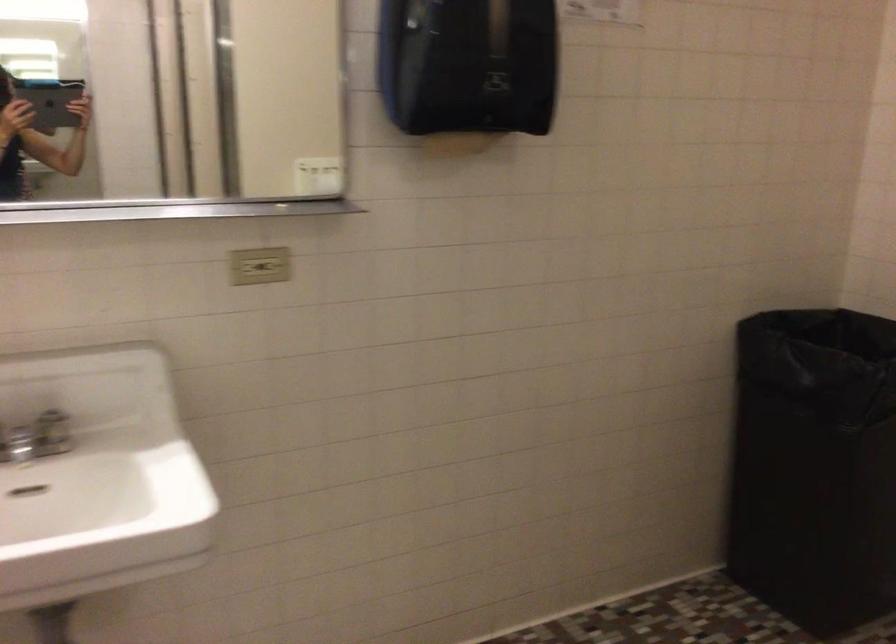
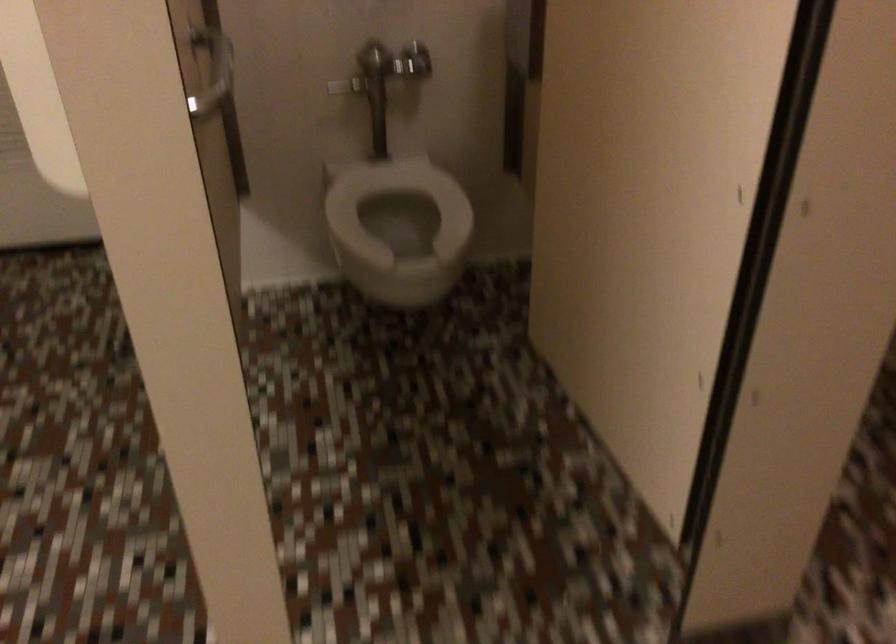
The images are taken continuously from a first-person perspective. In which direction is your viewpoint rotating?

The rotation direction of the camera is right-down.